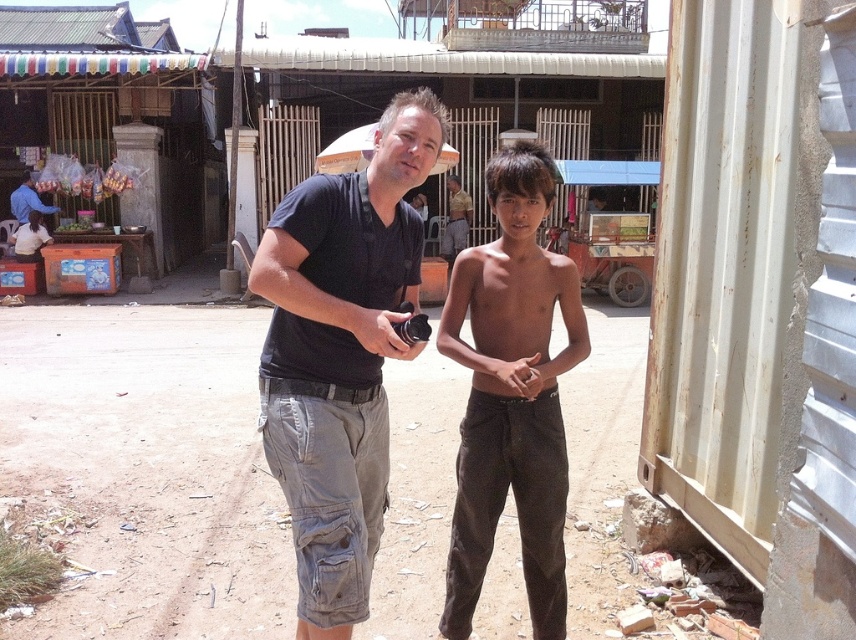
Question: Which object appears closest to the camera in this image?

Choices:
 (A) matte black camera at center
 (B) black cotton t-shirt at center
 (C) blue shirt at left
 (D) brown cotton pants at center

Answer: (A)

Question: Estimate the real-world distances between objects in this image. Which object is closer to the blue shirt at left?

Choices:
 (A) matte black camera at center
 (B) brown leather hand at center
 (C) black cotton t-shirt at center

Answer: (C)

Question: Can you confirm if light brown cotton shirt at center is positioned to the left of brown leather hand at center?

Choices:
 (A) no
 (B) yes

Answer: (A)

Question: Among these objects, which one is nearest to the camera?

Choices:
 (A) blue shirt at left
 (B) light brown cotton shirt at center

Answer: (A)

Question: Can you confirm if brown cotton pants at center is positioned below blue shirt at left?

Choices:
 (A) no
 (B) yes

Answer: (B)

Question: Can you confirm if brown leather hand at center is bigger than blue shirt at left?

Choices:
 (A) yes
 (B) no

Answer: (B)